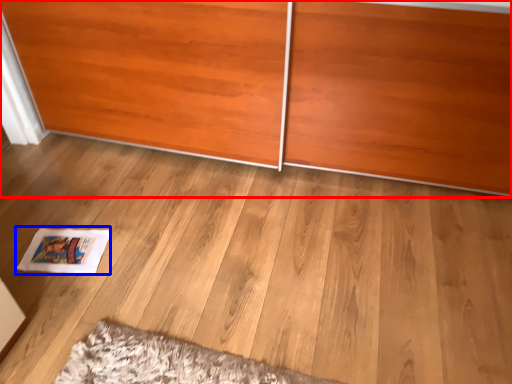
Question: Which of the following is the closest to the observer, furniture (highlighted by a red box) or magazine (highlighted by a blue box)?

Choices:
 (A) furniture
 (B) magazine

Answer: (A)